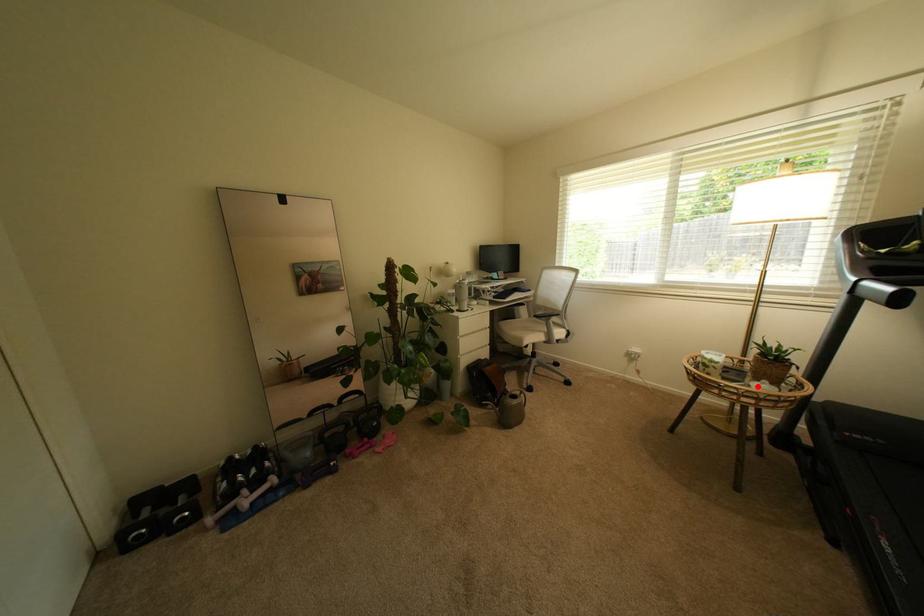
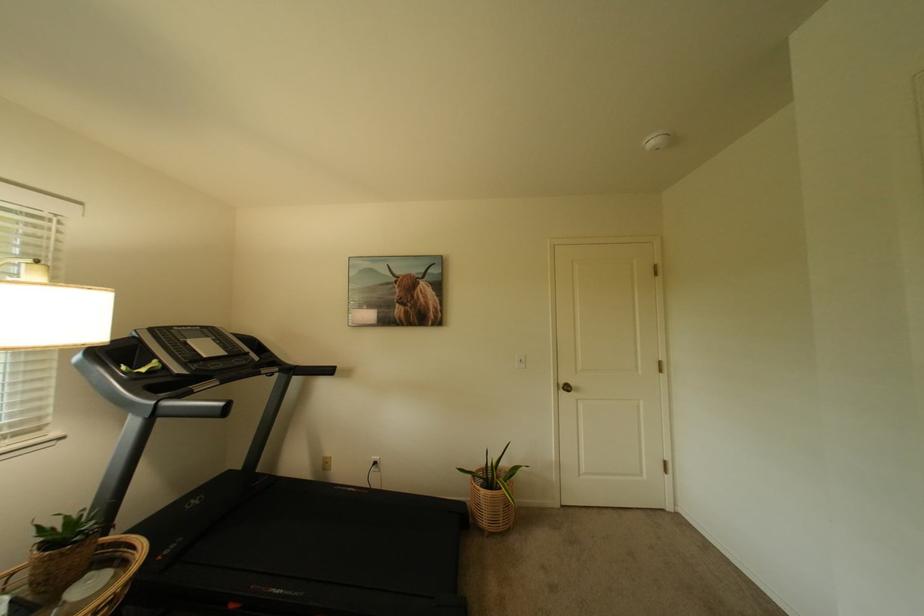
The point at the highlighted location is marked in the first image. Where is the corresponding point in the second image?

(73, 605)